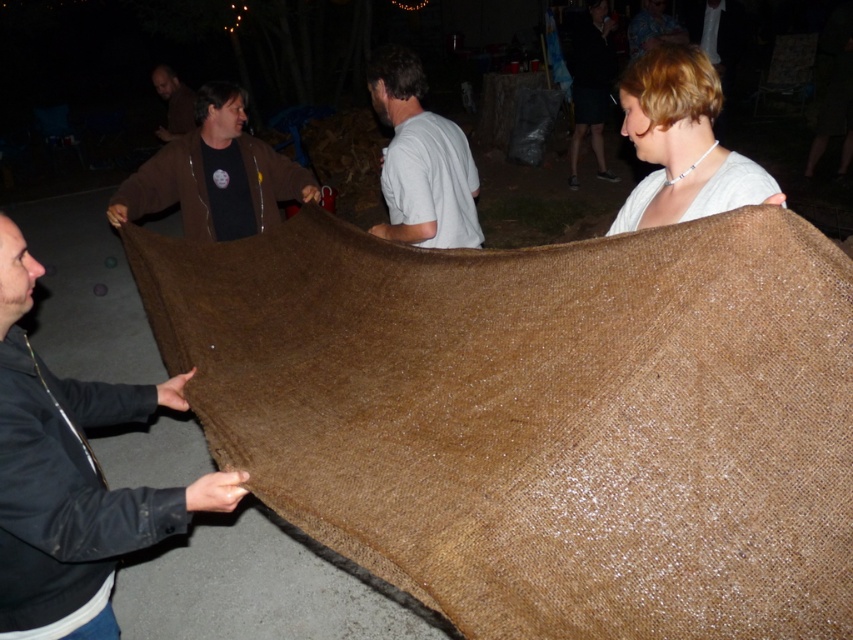
You are a photographer trying to capture a clear shot of the white matte shirt at center and the brown fabric at upper left. Since the scene is dimly lit, you need to adjust your camera settings. Which object should you focus on first to ensure proper exposure, considering their sizes in the frame?

The white matte shirt at center is much taller than the brown fabric at upper left, so focusing on the white matte shirt at center first would ensure proper exposure due to its larger size in the frame.

You are organizing a costume party and need to decide which item to use as a backdrop. The light brown fabric at upper right and the brown fuzzy sweater at upper center are available. Which item is smaller and better suited for a smaller backdrop setup?

The light brown fabric at upper right is smaller than the brown fuzzy sweater at upper center, making it better suited for a smaller backdrop setup.